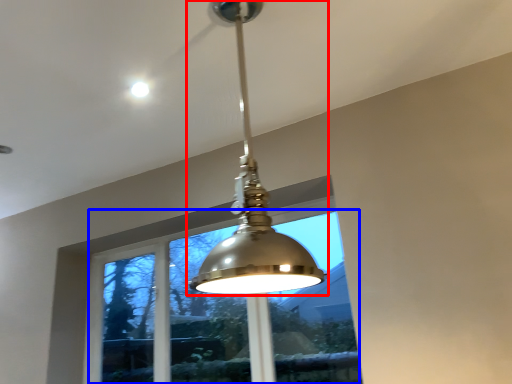
Question: Which of the following is the closest to the observer, lamp (highlighted by a red box) or window (highlighted by a blue box)?

Choices:
 (A) lamp
 (B) window

Answer: (A)